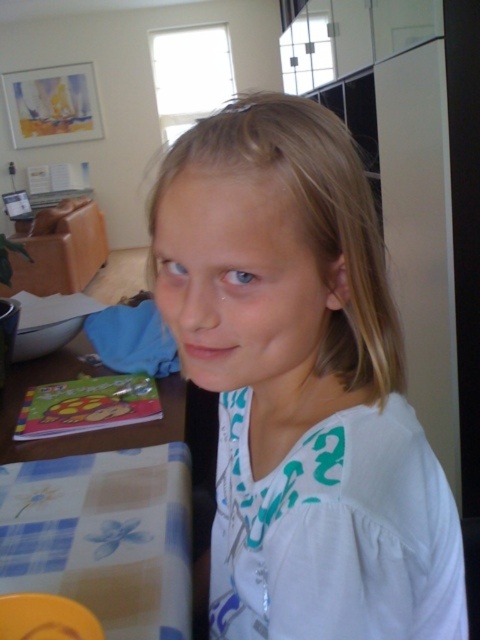
Who is more distant from viewer, (180, 596) or (169, 424)?

The point (169, 424) is behind.

Between point (187, 593) and point (79, 444), which one is positioned in front?

Point (187, 593)

Which is behind, point (98, 540) or point (85, 445)?

Positioned behind is point (85, 445).

Identify the location of plaid fabric tablecloth at lower left. The image size is (480, 640). (104, 536).

Who is positioned more to the left, white cotton shirt at center or wooden table at lower left?

wooden table at lower left is more to the left.

At what (x,y) coordinates should I click in order to perform the action: click on white cotton shirt at center. Please return your answer as a coordinate pair (x, y). Looking at the image, I should click on (301, 381).

Who is positioned more to the right, white cotton shirt at center or plaid fabric tablecloth at lower left?

Positioned to the right is white cotton shirt at center.

Is white cotton shirt at center to the right of plaid fabric tablecloth at lower left from the viewer's perspective?

Yes, white cotton shirt at center is to the right of plaid fabric tablecloth at lower left.

Which is in front, point (370, 512) or point (144, 620)?

Point (370, 512)

The image size is (480, 640). In order to click on white cotton shirt at center in this screenshot , I will do `click(301, 381)`.